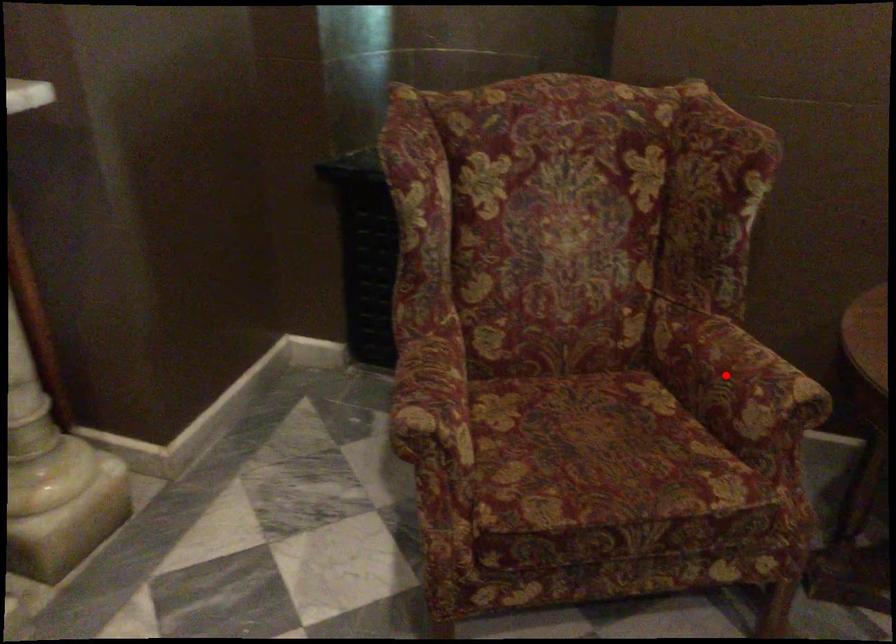
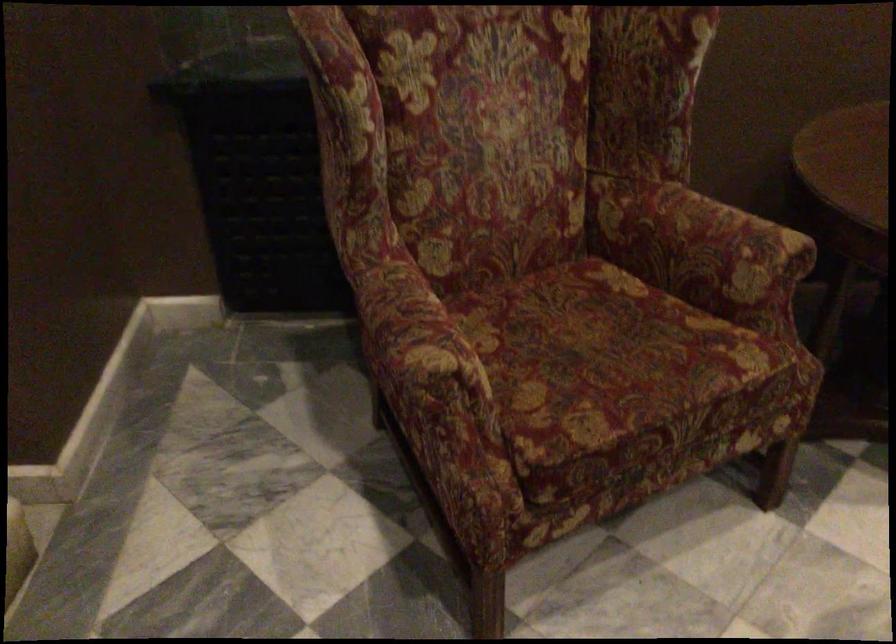
Question: I am providing you with two images of the same scene from different viewpoints. A red point is marked on the first image. Can you still see the location of the red point in image 2?

Choices:
 (A) Yes
 (B) No

Answer: (A)